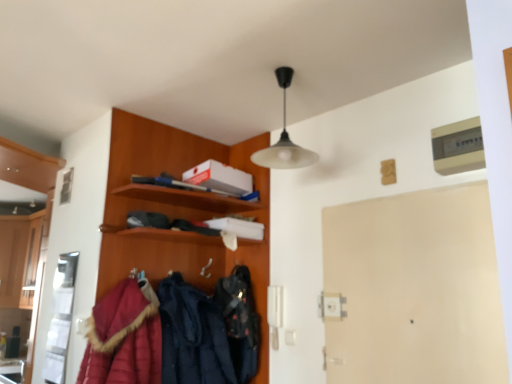
Question: Is point (284, 72) closer or farther from the camera than point (238, 337)?

Choices:
 (A) farther
 (B) closer

Answer: (B)

Question: From a real-world perspective, is matte black pendant light at upper center physically located above or below velvet black bag at center, positioned as the first clothing in right-to-left order?

Choices:
 (A) below
 (B) above

Answer: (B)

Question: Which of these objects is positioned farthest from the matte black pendant light at upper center?

Choices:
 (A) brushed metal cabinet at left
 (B) velvet black bag at center, positioned as the first clothing in right-to-left order
 (C) wooden coat rack at upper left
 (D) quilted red coat at lower left
 (E) velvet-like navy blue coat at center, marked as the 2th clothing in a right-to-left arrangement

Answer: (A)

Question: Estimate the real-world distances between objects in this image. Which object is closer to the brushed metal cabinet at left?

Choices:
 (A) quilted red coat at lower left
 (B) beige matte door at center
 (C) velvet black bag at center, positioned as the first clothing in right-to-left order
 (D) wooden coat rack at upper left
 (E) matte black pendant light at upper center

Answer: (D)